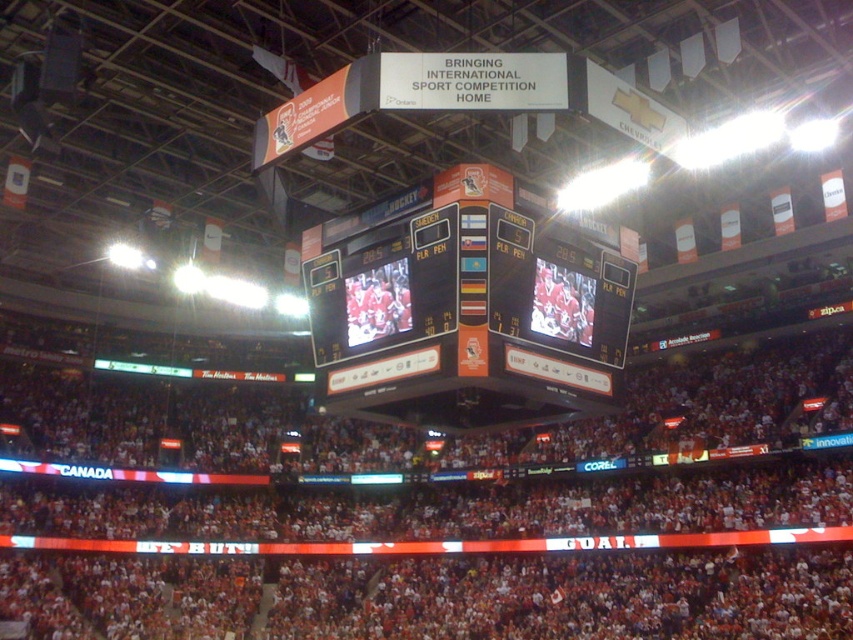
Which is more to the left, red fabric crowd at center or orange glossy scoreboard at center?

red fabric crowd at center

Is red fabric crowd at center positioned behind orange glossy scoreboard at center?

Yes, it is behind orange glossy scoreboard at center.

Measure the distance between red fabric crowd at center and camera.

A distance of 66.67 meters exists between red fabric crowd at center and camera.

Where is `red fabric crowd at center`? red fabric crowd at center is located at coordinates (445, 504).